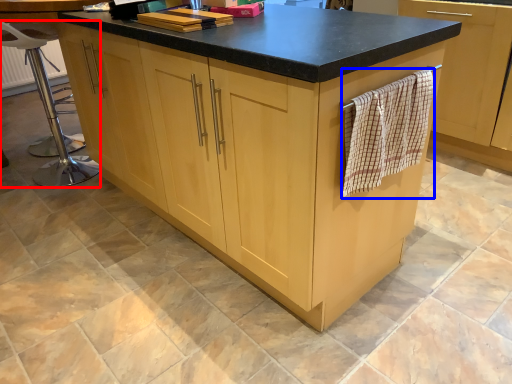
Question: Which of the following is the closest to the observer, bar stool (highlighted by a red box) or bath towel (highlighted by a blue box)?

Choices:
 (A) bar stool
 (B) bath towel

Answer: (B)